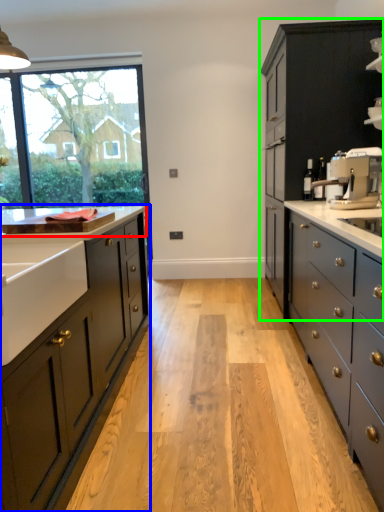
Question: Which object is the closest to the countertop (highlighted by a red box)? Choose among these: cabinetry (highlighted by a blue box) or cabinetry (highlighted by a green box).

Choices:
 (A) cabinetry
 (B) cabinetry

Answer: (A)